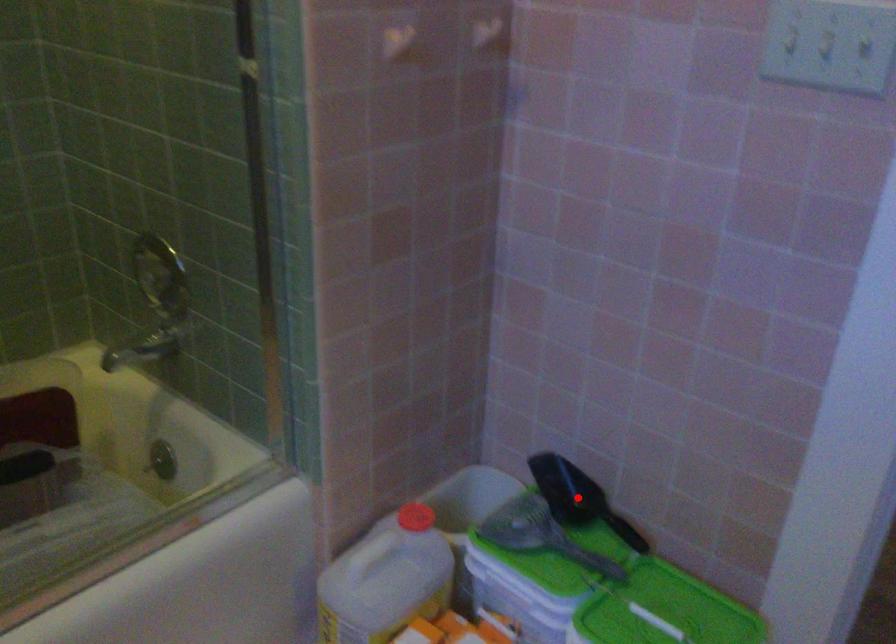
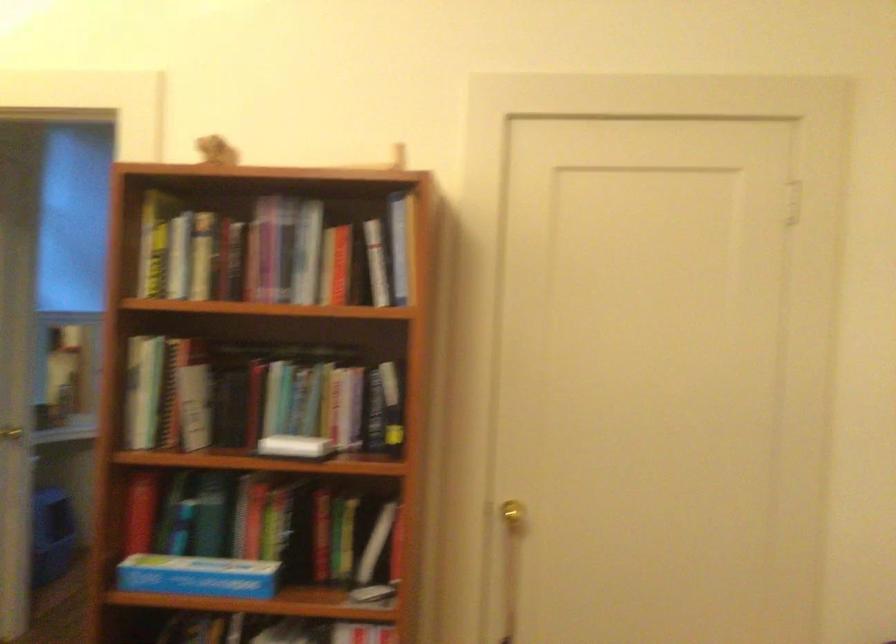
Question: I am providing you with two images of the same scene from different viewpoints. A red point is marked on the first image. Can you still see the location of the red point in image 2?

Choices:
 (A) Yes
 (B) No

Answer: (B)